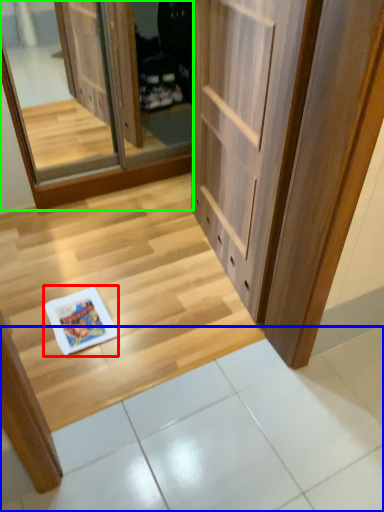
Question: Which is nearer to the magazine (highlighted by a red box)? tile (highlighted by a blue box) or screen door (highlighted by a green box).

Choices:
 (A) tile
 (B) screen door

Answer: (A)